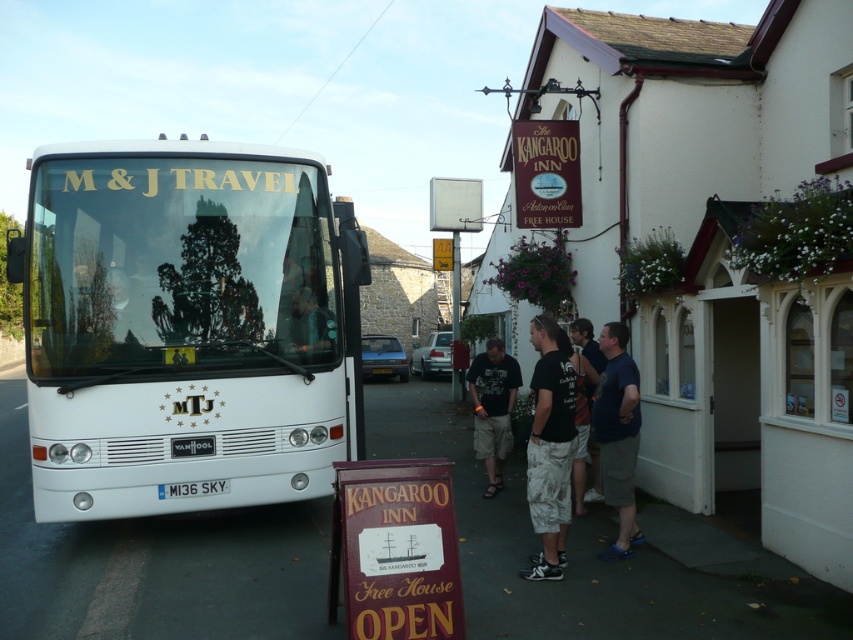
Can you confirm if white matte bus at left is positioned to the right of dark blue t-shirt at center?

In fact, white matte bus at left is to the left of dark blue t-shirt at center.

Measure the distance between white matte bus at left and dark blue t-shirt at center.

9.20 feet

Which is behind, point (299, 364) or point (607, 467)?

Point (299, 364)

Find the location of `white matte bus at left`. white matte bus at left is located at coordinates (187, 326).

Is white matte bus at left below black cotton t-shirt at center?

Actually, white matte bus at left is above black cotton t-shirt at center.

Is white matte bus at left shorter than black cotton t-shirt at center?

No.

Is point (135, 385) positioned after point (556, 333)?

Yes, point (135, 385) is farther from viewer.

The width and height of the screenshot is (853, 640). I want to click on white matte bus at left, so click(187, 326).

Between point (619, 458) and point (479, 442), which one is positioned in front?

Point (619, 458)

Where is `dark blue t-shirt at center`? dark blue t-shirt at center is located at coordinates (618, 435).